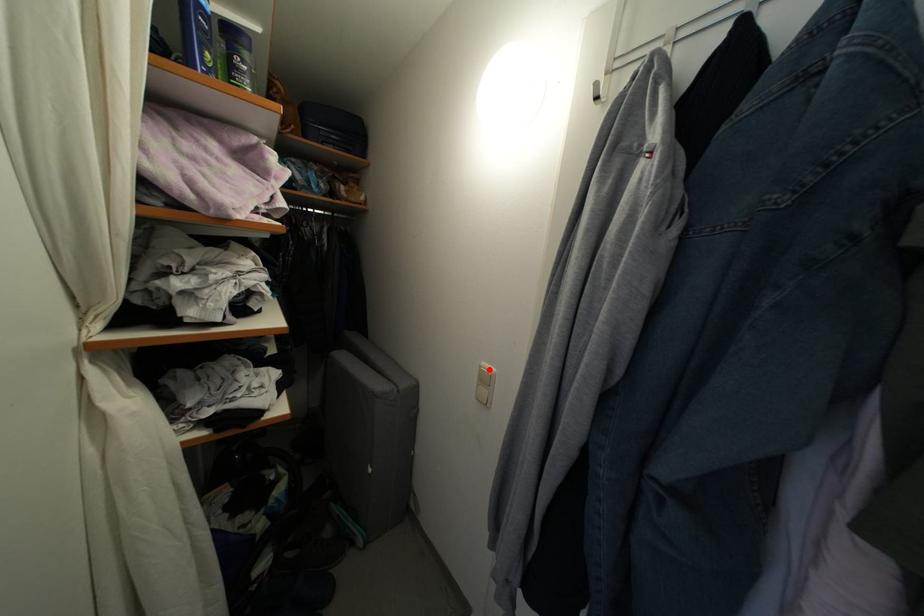
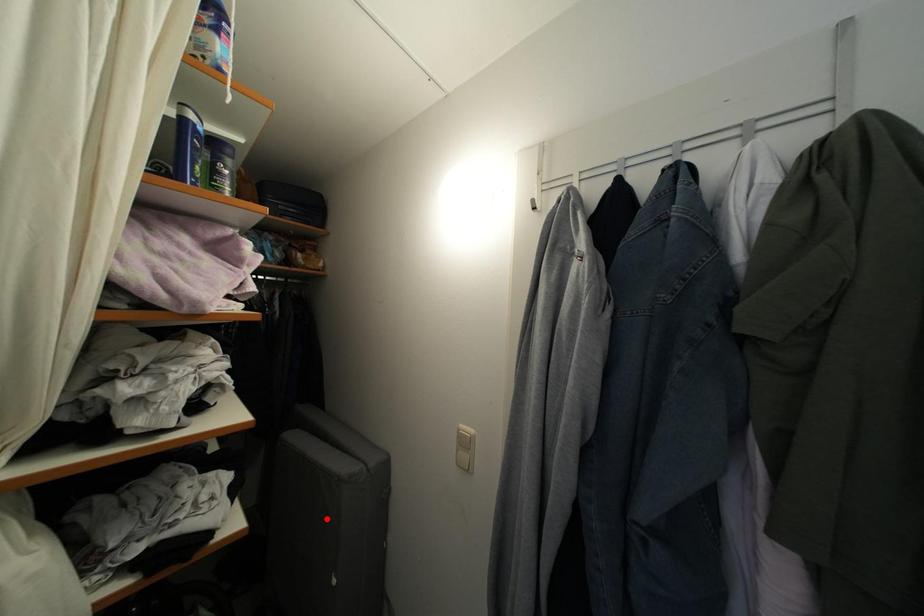
I am providing you with two images of the same scene from different viewpoints. A red point is marked on the first image and another point is marked on the second image. Does the point marked in image1 correspond to the same location as the one in image2?

No